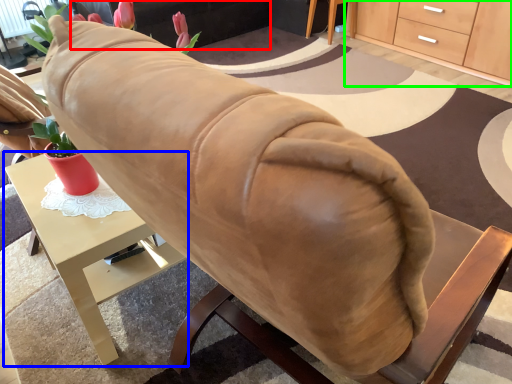
Question: Based on their relative distances, which object is farther from couch (highlighted by a red box)? Choose from desk (highlighted by a blue box) and cabinetry (highlighted by a green box).

Choices:
 (A) desk
 (B) cabinetry

Answer: (A)